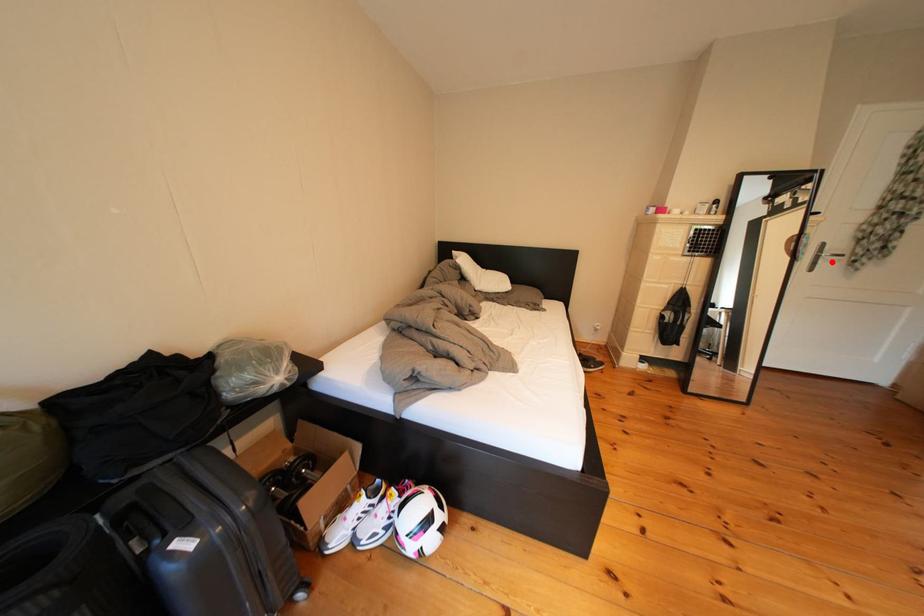
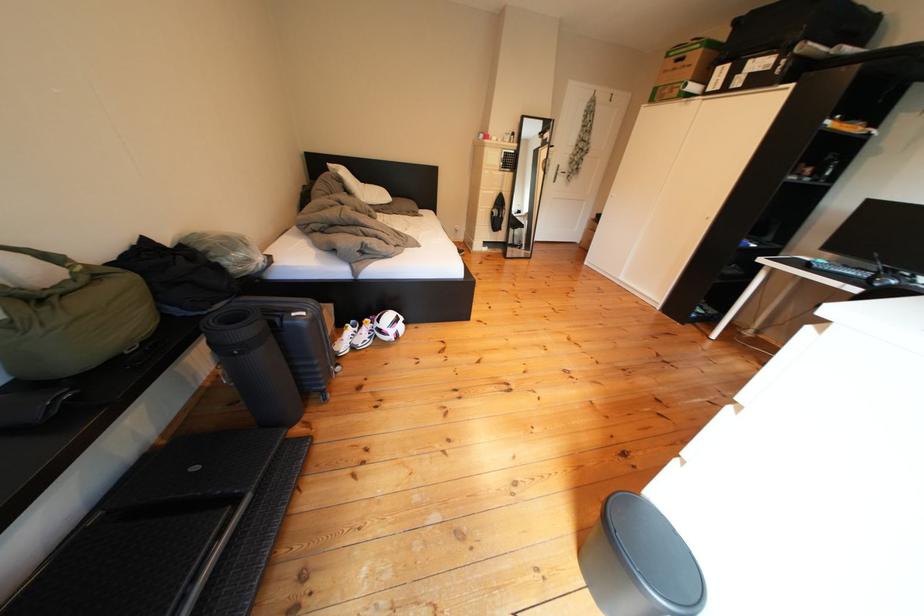
Question: I am providing you with two images of the same scene from different viewpoints. A red point is shown in image1. For the corresponding object point in image2, is it positioned nearer or farther from the camera?

Choices:
 (A) Nearer
 (B) Farther

Answer: (A)